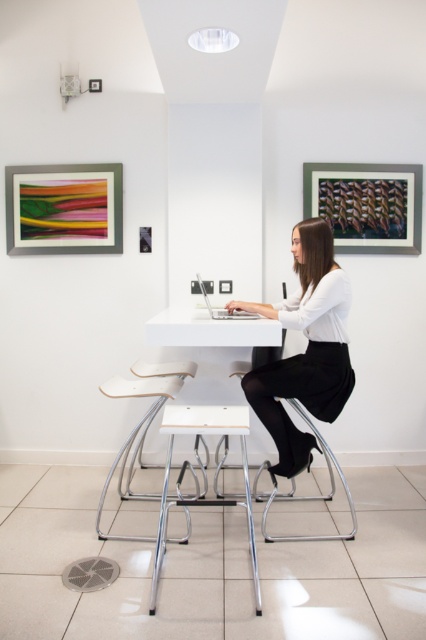
Does white leather stool at center have a larger size compared to chrome metal bar stool at center?

Yes, white leather stool at center is bigger than chrome metal bar stool at center.

Is point (189, 364) farther from camera compared to point (351, 500)?

Yes, it is behind point (351, 500).

I want to click on white leather stool at center, so click(141, 420).

Does white plastic stool at center appear under white matte table at center?

Yes.

Does white plastic stool at center have a lesser height compared to white matte table at center?

No, white plastic stool at center is not shorter than white matte table at center.

Identify the location of white plastic stool at center. This screenshot has width=426, height=640. click(204, 499).

Locate an element on the screen. This screenshot has width=426, height=640. white matte skirt at center is located at coordinates (305, 349).

Which is behind, point (339, 300) or point (137, 444)?

Point (137, 444)

Is point (262, 314) behind point (178, 388)?

No, (262, 314) is in front of (178, 388).

Locate an element on the screen. This screenshot has height=640, width=426. white matte skirt at center is located at coordinates (305, 349).